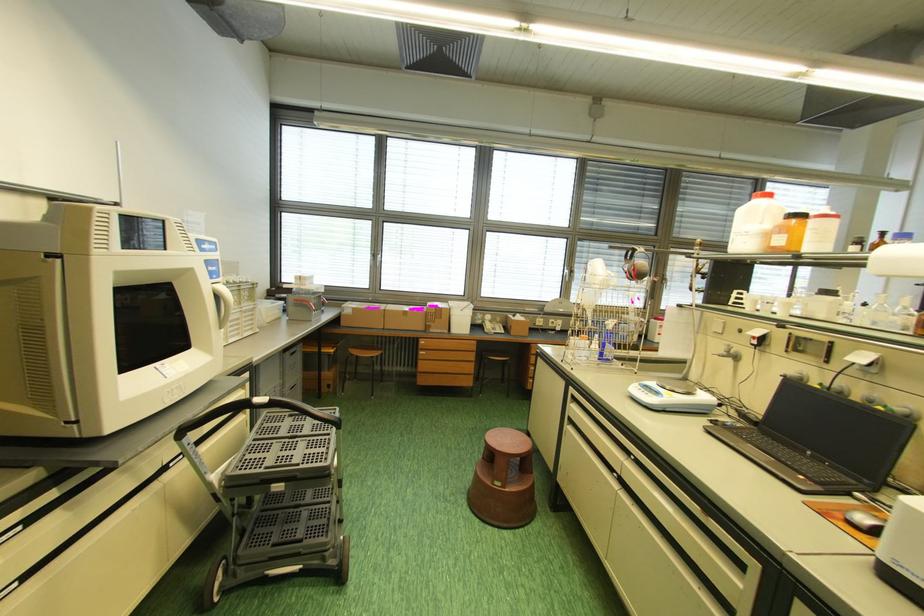
Find where to slid the computer mouse. Please return your answer as a coordinate pair (x, y).

(865, 522)